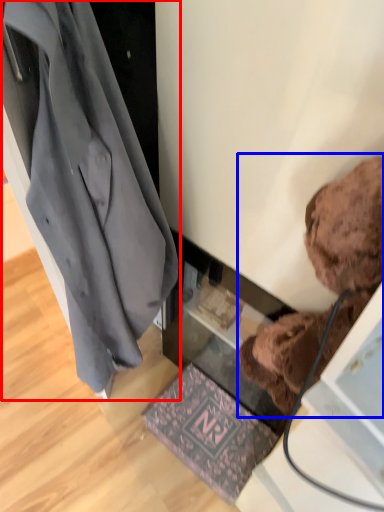
Question: Which object is further to the camera taking this photo, coat (highlighted by a red box) or teddy bear (highlighted by a blue box)?

Choices:
 (A) coat
 (B) teddy bear

Answer: (A)